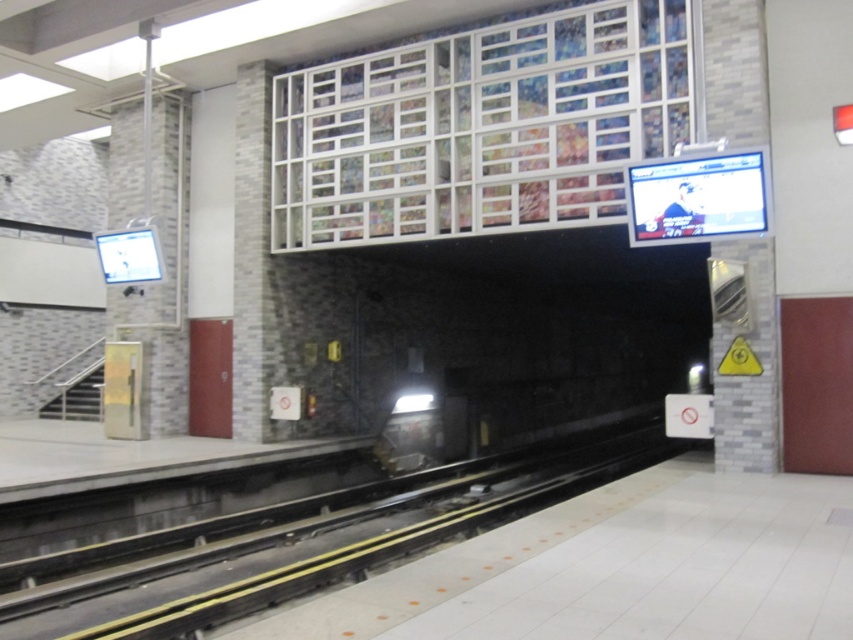
You are a maintenance worker who needs to inspect the black rubber train track at center. Your tool kit is 6 meters long. Can you safely reach the track from where you are standing without moving closer?

The black rubber train track at center is 5.98 meters from camera. Since the tool kit is 6 meters long, you can safely reach the track from your current position without needing to move closer.